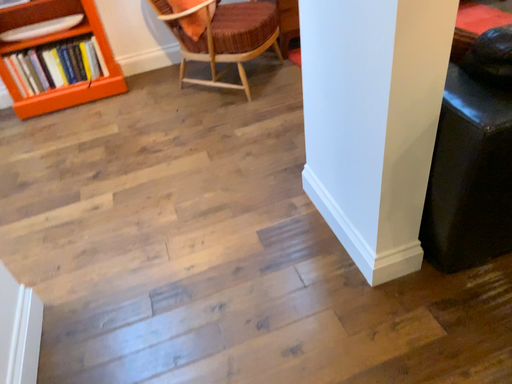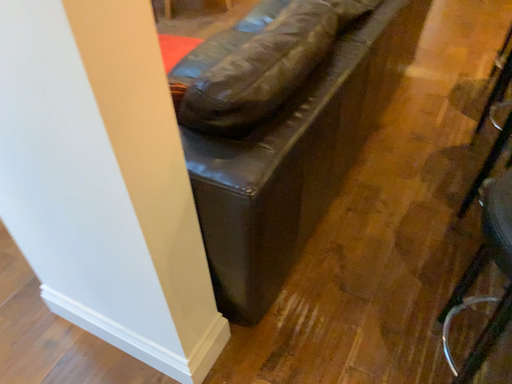
Question: Which way did the camera rotate in the video?

Choices:
 (A) rotated right
 (B) rotated left

Answer: (A)